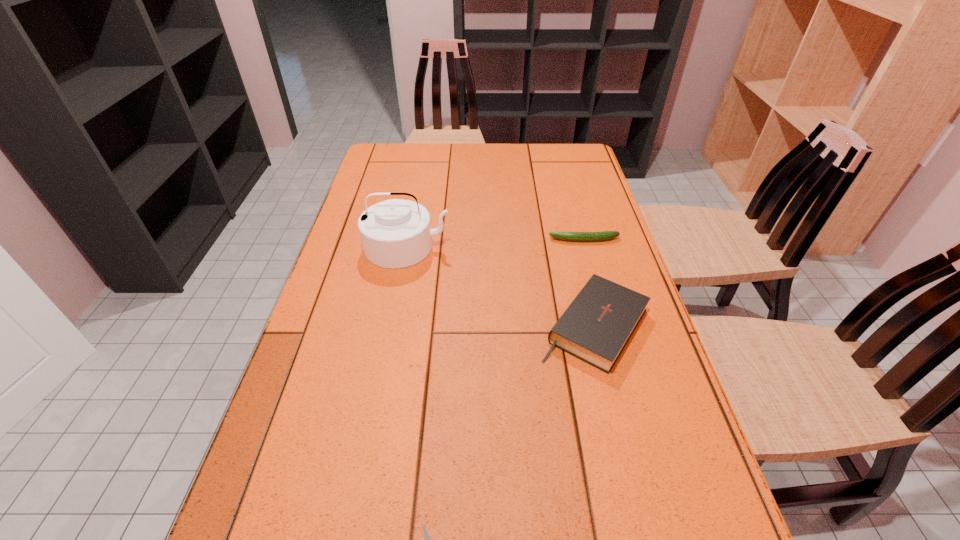
Locate an element on the screen. Bible at the right edge is located at coordinates pyautogui.click(x=596, y=326).

The height and width of the screenshot is (540, 960). In order to click on zucchini that is at the right edge in this screenshot , I will do `click(605, 235)`.

This screenshot has height=540, width=960. In order to click on free space at the far edge of the desktop in this screenshot , I will do `click(469, 159)`.

The image size is (960, 540). What are the coordinates of `free space at the left edge of the desktop` in the screenshot? It's located at (361, 243).

In the image, there is a desktop. Where is `vacant space at the right edge`? The width and height of the screenshot is (960, 540). vacant space at the right edge is located at coordinates (644, 317).

Where is `vacant space at the far left corner of the desktop`? The image size is (960, 540). vacant space at the far left corner of the desktop is located at coordinates (396, 167).

Locate an element on the screen. The image size is (960, 540). free location at the far right corner of the desktop is located at coordinates (575, 154).

Where is `blank region between the second shortest object and the kettle`? blank region between the second shortest object and the kettle is located at coordinates (495, 243).

The width and height of the screenshot is (960, 540). What are the coordinates of `free space between the kettle and the second shortest object` in the screenshot? It's located at (495, 243).

This screenshot has width=960, height=540. Find the location of `vacant point located between the tallest object and the third tallest object`. vacant point located between the tallest object and the third tallest object is located at coordinates (495, 243).